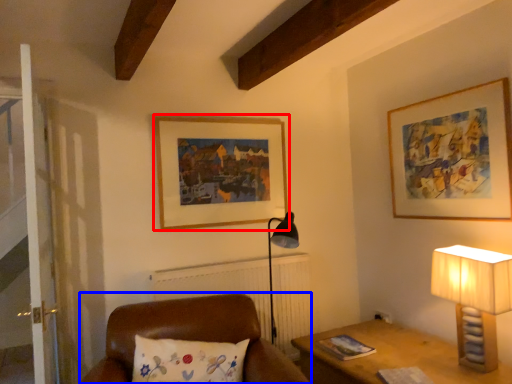
Question: Which object is closer to the camera taking this photo, picture frame (highlighted by a red box) or furniture (highlighted by a blue box)?

Choices:
 (A) picture frame
 (B) furniture

Answer: (B)